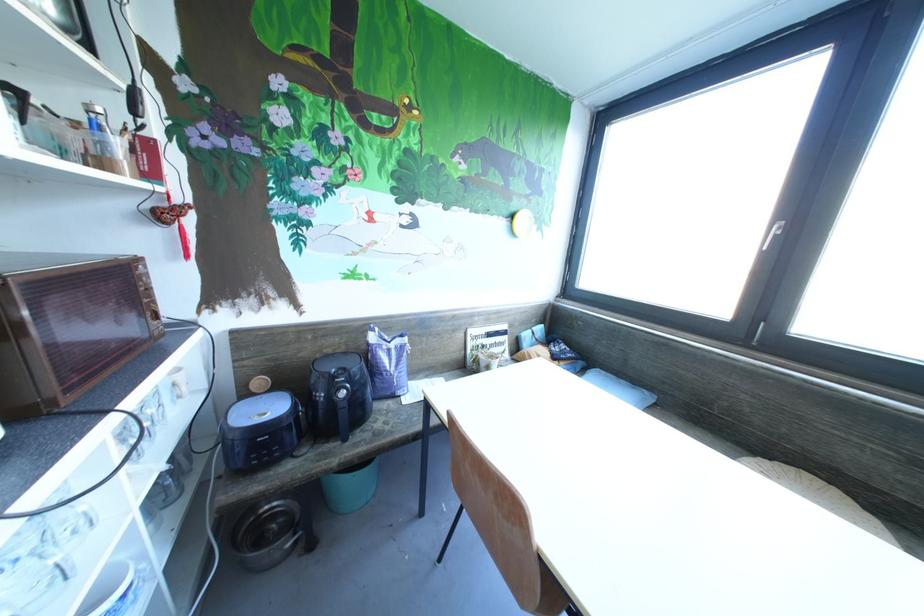
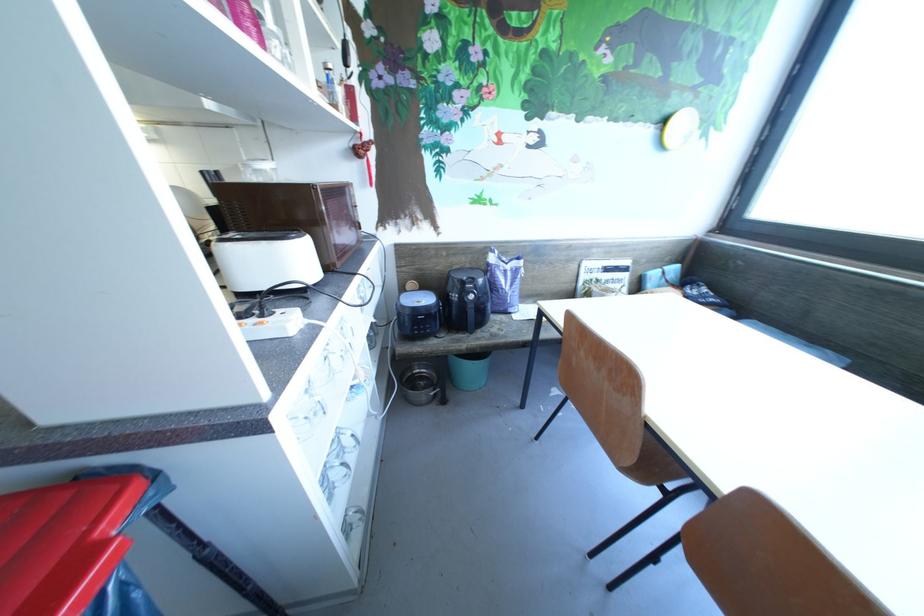
Where in the second image is the point corresponding to pixel 395 353 from the first image?

(512, 274)